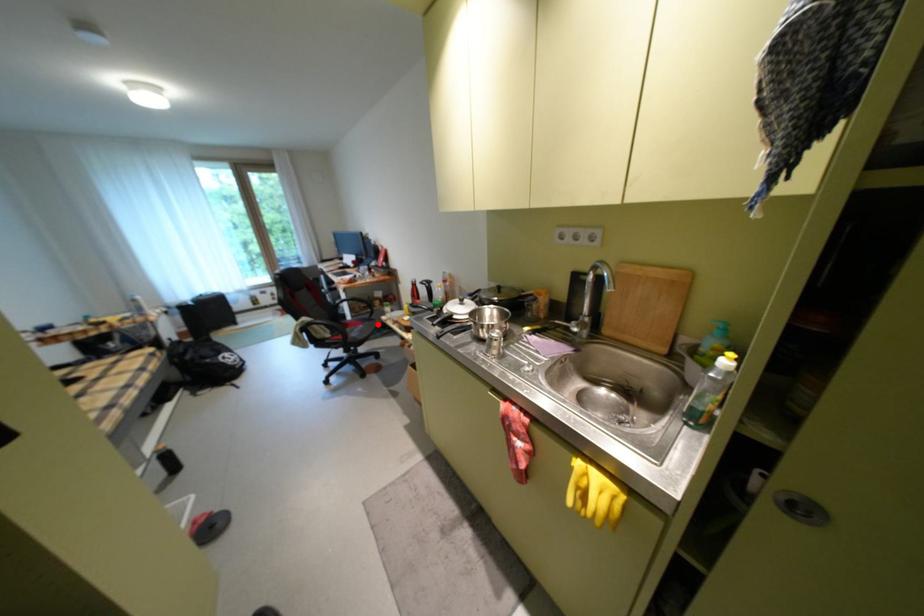
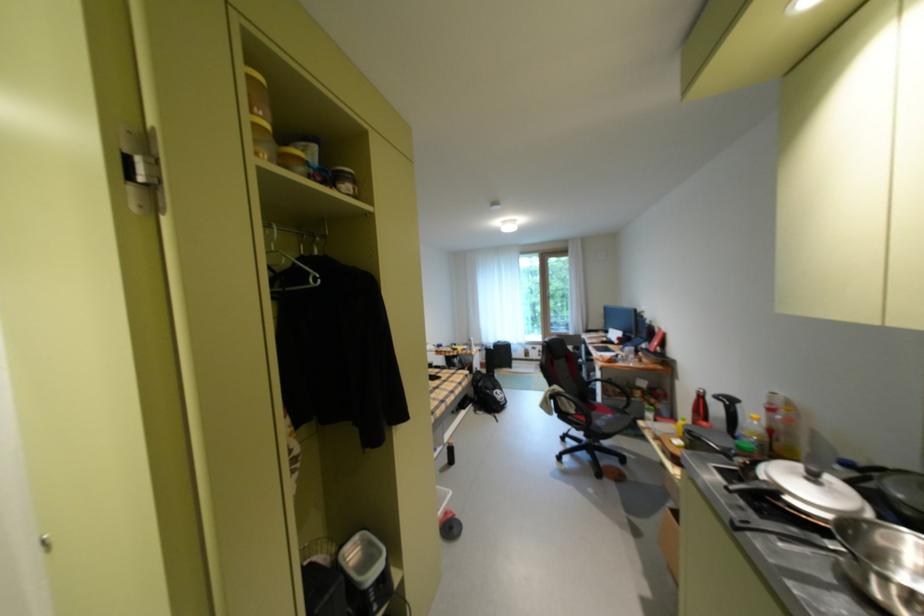
Where in the second image is the point corresponding to the highlighted location from the first image?

(629, 416)